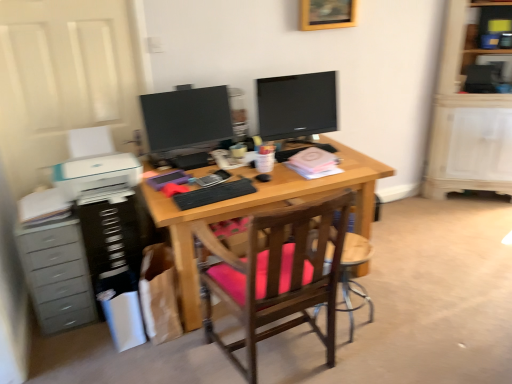
Locate an element on the screen. Image resolution: width=512 pixels, height=384 pixels. vacant region under wooden chair with pink cushion at center (from a real-world perspective) is located at coordinates (278, 359).